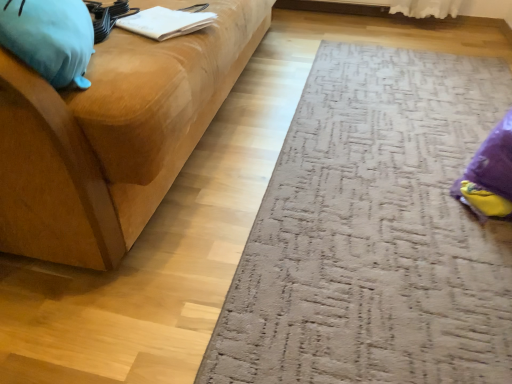
Question: From a real-world perspective, is soft blue plush at left under matte wood studio couch at left?

Choices:
 (A) yes
 (B) no

Answer: (B)

Question: Can you confirm if soft blue plush at left is positioned to the left of matte wood studio couch at left?

Choices:
 (A) yes
 (B) no

Answer: (B)

Question: Is soft blue plush at left further to camera compared to matte wood studio couch at left?

Choices:
 (A) no
 (B) yes

Answer: (B)

Question: Considering the relative sizes of soft blue plush at left and matte wood studio couch at left in the image provided, is soft blue plush at left wider than matte wood studio couch at left?

Choices:
 (A) no
 (B) yes

Answer: (A)

Question: Does soft blue plush at left touch matte wood studio couch at left?

Choices:
 (A) no
 (B) yes

Answer: (A)

Question: Considering the relative sizes of soft blue plush at left and matte wood studio couch at left in the image provided, is soft blue plush at left taller than matte wood studio couch at left?

Choices:
 (A) no
 (B) yes

Answer: (A)

Question: Considering the relative sizes of matte wood studio couch at left and soft blue plush at left in the image provided, is matte wood studio couch at left smaller than soft blue plush at left?

Choices:
 (A) yes
 (B) no

Answer: (B)

Question: Can you confirm if matte wood studio couch at left is thinner than soft blue plush at left?

Choices:
 (A) no
 (B) yes

Answer: (A)

Question: From the image's perspective, is matte wood studio couch at left under soft blue plush at left?

Choices:
 (A) no
 (B) yes

Answer: (A)

Question: Is matte wood studio couch at left not near soft blue plush at left?

Choices:
 (A) yes
 (B) no

Answer: (B)

Question: Is soft blue plush at left at the back of matte wood studio couch at left?

Choices:
 (A) yes
 (B) no

Answer: (B)

Question: From a real-world perspective, is matte wood studio couch at left beneath soft blue plush at left?

Choices:
 (A) no
 (B) yes

Answer: (B)

Question: Does white paper at upper left appear on the right side of textured gray doormat at lower right?

Choices:
 (A) no
 (B) yes

Answer: (A)